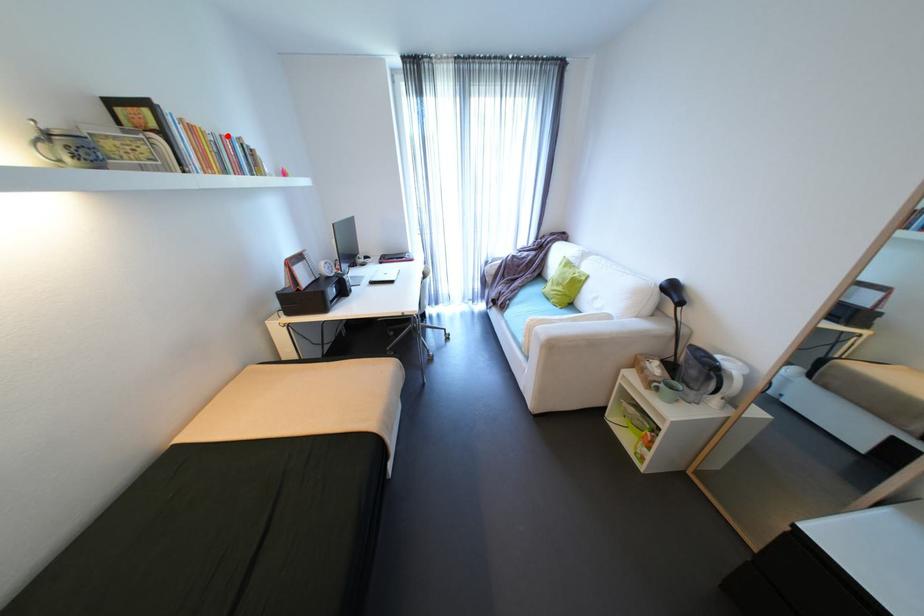
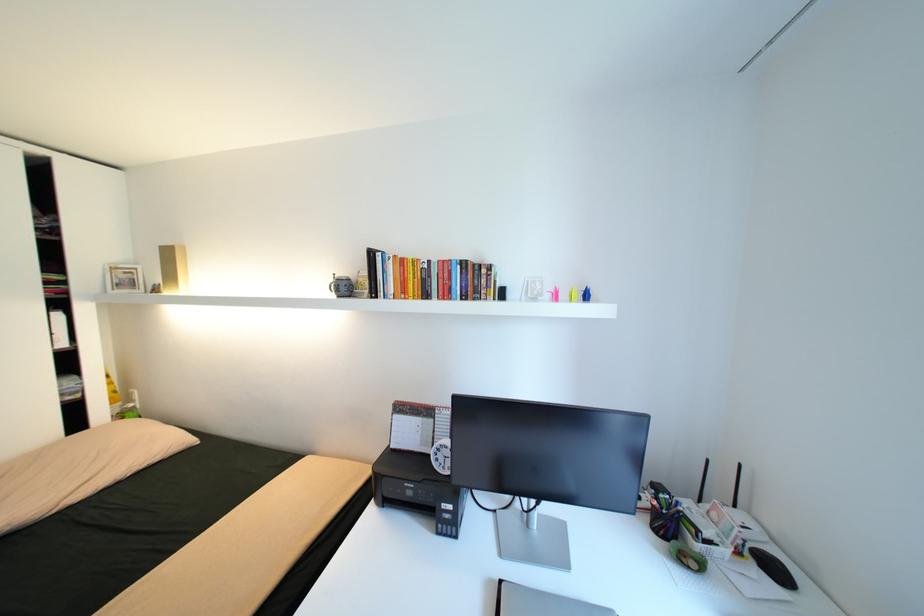
Find the pixel in the second image that matches the highlighted location in the first image.

(445, 262)